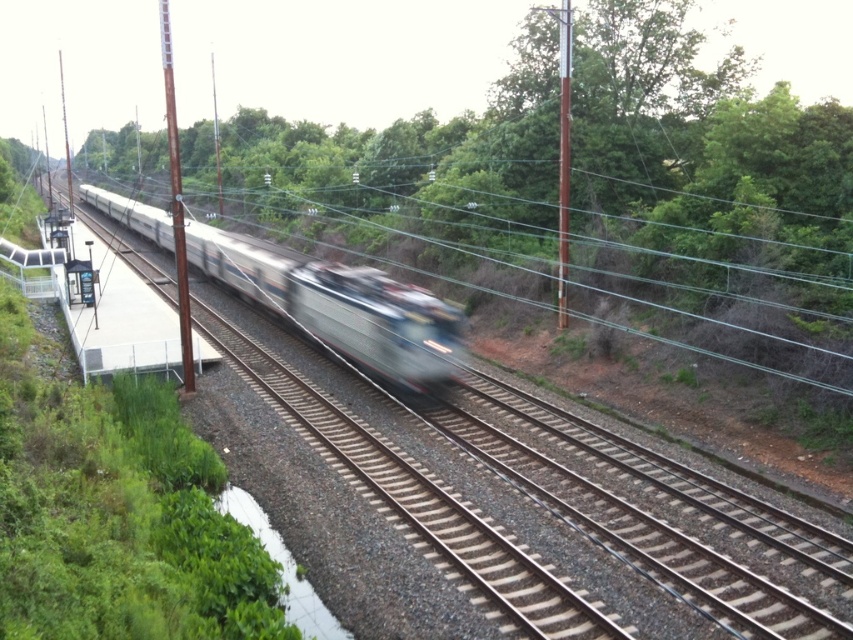
Question: Is silver metallic train at center below rusty metal pole at left?

Choices:
 (A) no
 (B) yes

Answer: (B)

Question: Is rusty metal pole at left below metallic pole at upper right?

Choices:
 (A) no
 (B) yes

Answer: (A)

Question: Observing the image, what is the correct spatial positioning of rusty metal pole at left in reference to metallic pole at upper right?

Choices:
 (A) left
 (B) right

Answer: (A)

Question: Which point is farther from the camera taking this photo?

Choices:
 (A) click(561, 64)
 (B) click(436, 352)
 (C) click(181, 250)

Answer: (A)

Question: Which point is farther from the camera taking this photo?

Choices:
 (A) (469, 545)
 (B) (381, 282)

Answer: (B)

Question: Which point is closer to the camera?

Choices:
 (A) silver metallic train at center
 (B) metallic pole at upper right

Answer: (A)